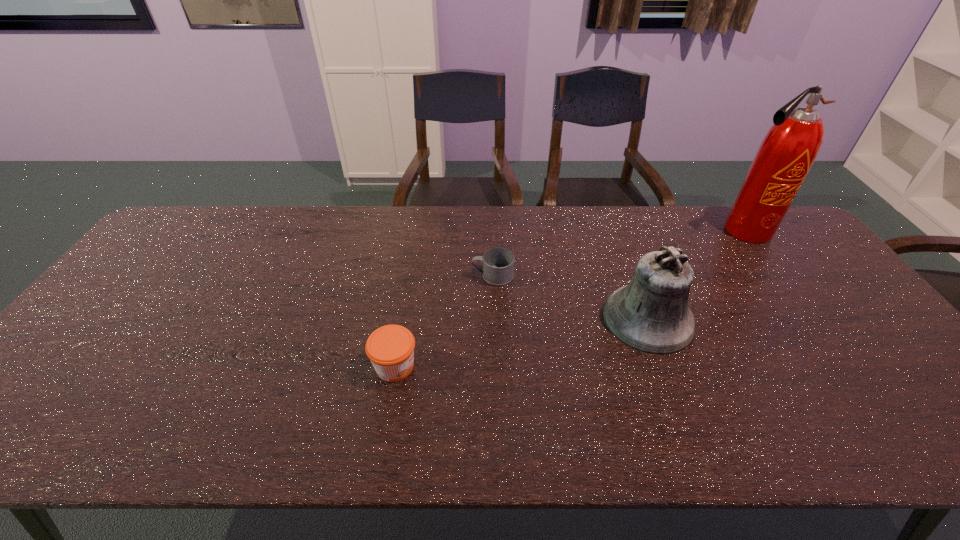
Where is `vacant point located 0.340m on the front label of the leftmost object`? The width and height of the screenshot is (960, 540). vacant point located 0.340m on the front label of the leftmost object is located at coordinates (560, 366).

Find the location of a particular element. The width and height of the screenshot is (960, 540). free location located 0.190m on the side of the shortest object with the handle is located at coordinates (407, 276).

I want to click on free region located on the side of the shortest object with the handle, so click(431, 276).

In order to click on vacant area located 0.220m on the side of the shortest object with the handle in this screenshot , I will do `click(397, 276)`.

You are a GUI agent. You are given a task and a screenshot of the screen. Output one action in this format:
    pyautogui.click(x=<x>, y=<y>)
    Task: Click on the object at the far edge
    This screenshot has width=960, height=540.
    Given the screenshot: What is the action you would take?
    pyautogui.click(x=789, y=149)

Identify the location of object present at the right edge. This screenshot has width=960, height=540. coord(789,149).

Locate an element on the screen. This screenshot has width=960, height=540. object that is positioned at the far right corner is located at coordinates (789, 149).

At what (x,y) coordinates should I click in order to perform the action: click on vacant space at the far edge of the desktop. Please return your answer as a coordinate pair (x, y). The width and height of the screenshot is (960, 540). Looking at the image, I should click on point(349,221).

Find the location of a particular element. This screenshot has height=540, width=960. vacant space at the near edge is located at coordinates (165, 421).

Identify the location of free spot at the left edge of the desktop. The height and width of the screenshot is (540, 960). (166, 261).